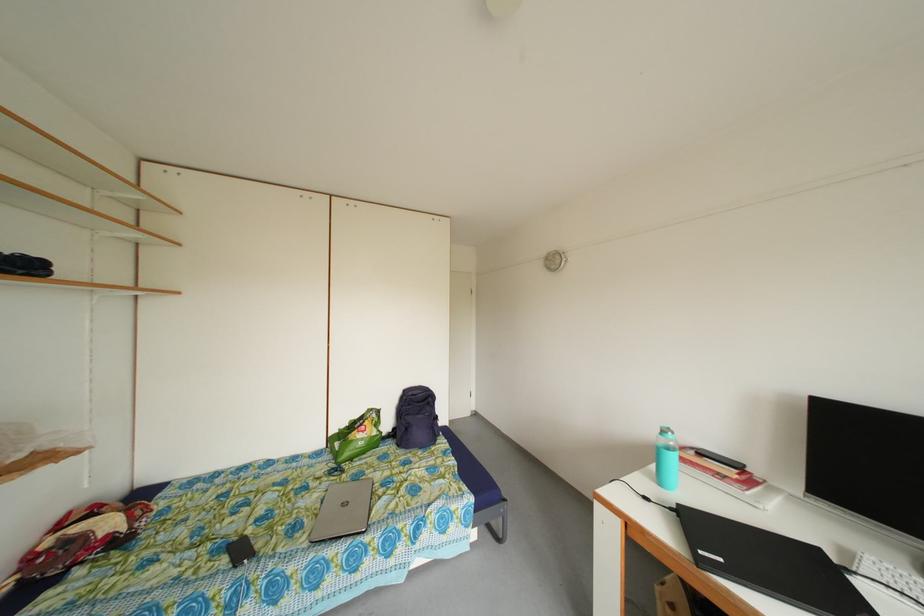
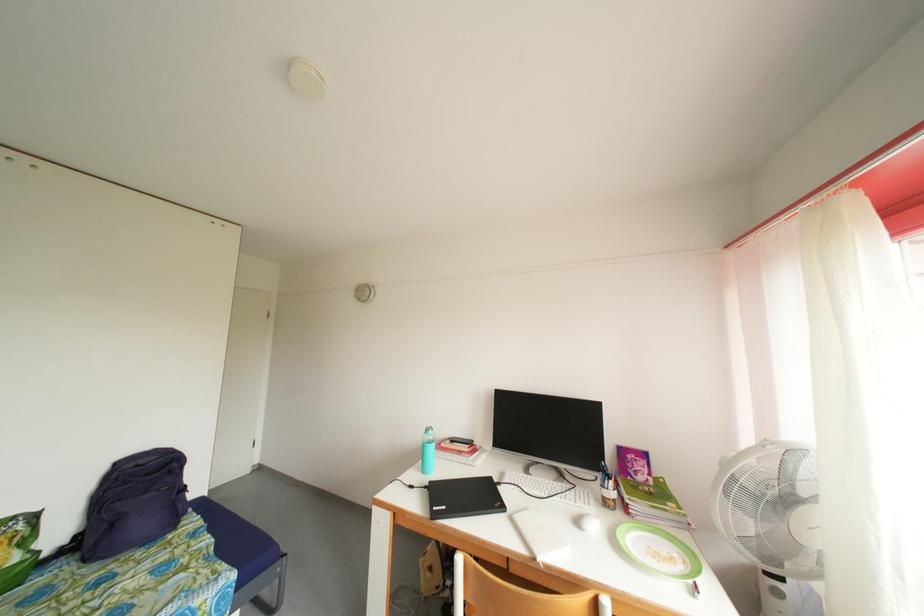
Find the pixel in the second image that matches (x=411, y=397) in the first image.

(124, 469)